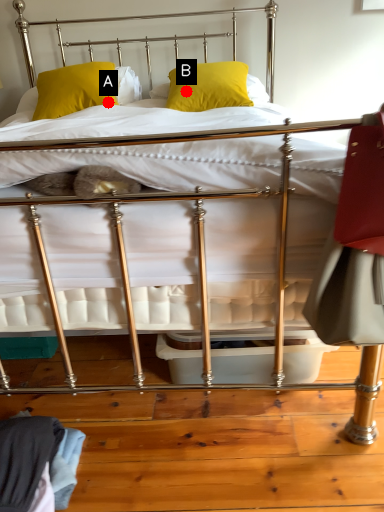
Question: Two points are circled on the image, labeled by A and B beside each circle. Which of the following is the closest to the observer?

Choices:
 (A) A is closer
 (B) B is closer

Answer: (B)